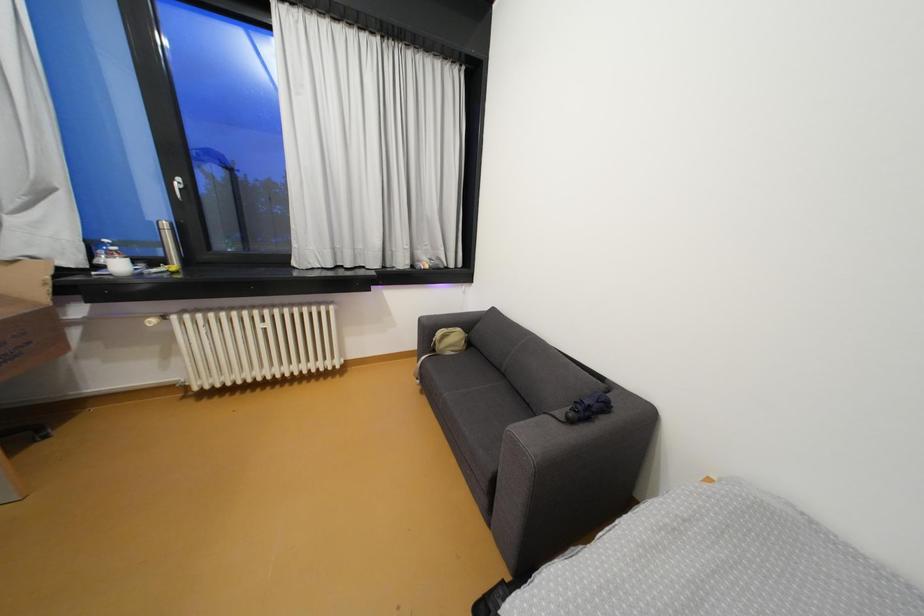
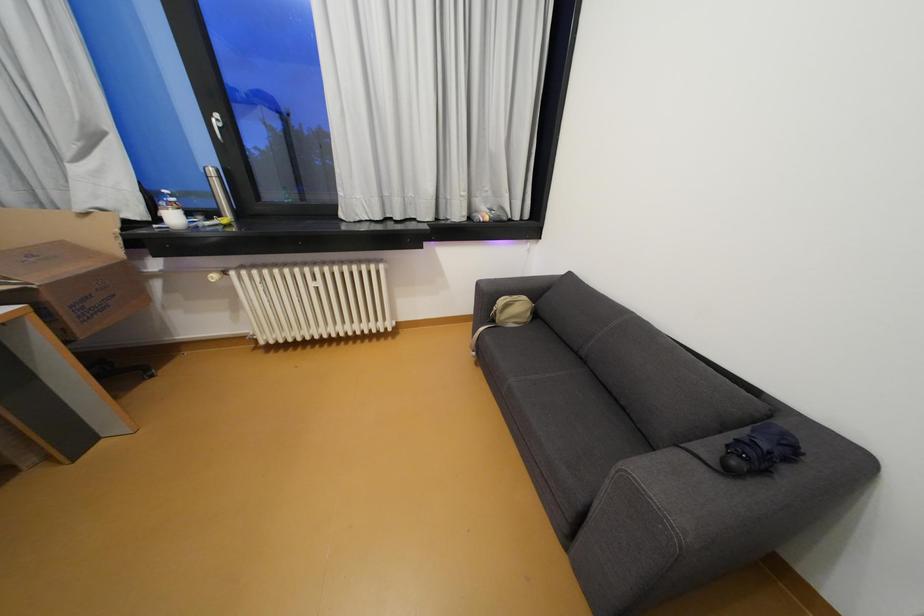
Question: The first image is from the beginning of the video and the second image is from the end. How did the camera likely rotate when shooting the video?

Choices:
 (A) Left
 (B) Right
 (C) Up
 (D) Down

Answer: (D)